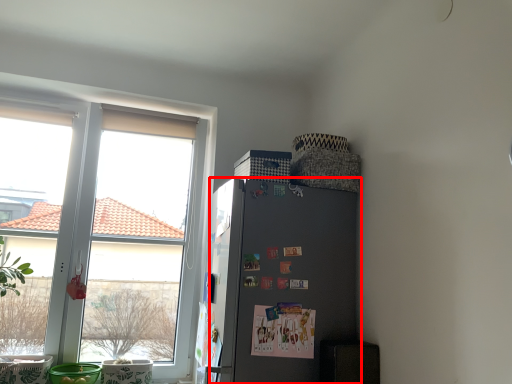
Question: From the image, what is the correct spatial relationship of refrigerator (annotated by the red box) in relation to window?

Choices:
 (A) left
 (B) right

Answer: (B)